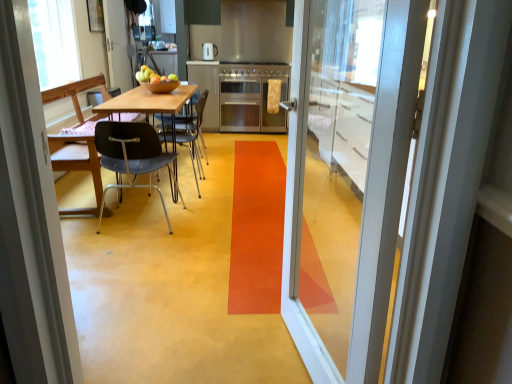
Describe the element at coordinates (133, 157) in the screenshot. I see `black plastic chair at left, the 2th chair viewed from the right` at that location.

Where is `black plastic chair at left, the 2th chair viewed from the right`? The image size is (512, 384). black plastic chair at left, the 2th chair viewed from the right is located at coordinates (133, 157).

How much space does white glossy door at upper left, which is counted as the 1th door, starting from the left, occupy horizontally?

The width of white glossy door at upper left, which is counted as the 1th door, starting from the left, is 4.67 inches.

Describe the element at coordinates (149, 103) in the screenshot. I see `wooden table at center` at that location.

You are a GUI agent. You are given a task and a screenshot of the screen. Output one action in this format:
    pyautogui.click(x=<x>, y=<y>)
    Task: Click on the satin silver refrigerator at center
    The height and width of the screenshot is (384, 512).
    Given the screenshot: What is the action you would take?
    pyautogui.click(x=207, y=89)

Would you consider black plastic chair at left, which is the third chair in left-to-right order, to be distant from white glossy door at upper left, arranged as the first door when viewed from the back?

That's right, there is a large distance between black plastic chair at left, which is the third chair in left-to-right order, and white glossy door at upper left, arranged as the first door when viewed from the back.

Which is behind, black plastic chair at left, which is the third chair in left-to-right order, or white glossy door at upper left, which is counted as the 1th door, starting from the top?

white glossy door at upper left, which is counted as the 1th door, starting from the top, is further away from the camera.

Is point (202, 140) in front of point (113, 36)?

No, it is behind (113, 36).

Is black plastic chair at left, the second chair viewed from the left, aimed at matte silver kettle at center?

Yes, black plastic chair at left, the second chair viewed from the left, is oriented towards matte silver kettle at center.

From a real-world perspective, is black plastic chair at left, the 2th chair viewed from the right, over matte silver kettle at center?

Actually, black plastic chair at left, the 2th chair viewed from the right, is physically below matte silver kettle at center in the real world.

From the picture: Measure the distance between black plastic chair at left, the 2th chair viewed from the right, and matte silver kettle at center.

black plastic chair at left, the 2th chair viewed from the right, is 3.48 meters away from matte silver kettle at center.

Between black plastic chair at left, the second chair viewed from the left, and matte silver kettle at center, which one has smaller width?

matte silver kettle at center is thinner.

From a real-world perspective, between white glossy door at upper left, the second door viewed from the right, and black plastic chair at left, which is the third chair in left-to-right order, who is vertically lower?

black plastic chair at left, which is the third chair in left-to-right order, from a real-world perspective.

Can black plastic chair at left, which is the third chair in left-to-right order, be found inside white glossy door at upper left, arranged as the first door when viewed from the back?

No, black plastic chair at left, which is the third chair in left-to-right order, is not a part of white glossy door at upper left, arranged as the first door when viewed from the back.

From the image's perspective, does white glossy door at upper left, the second door positioned from the front, appear lower than black plastic chair at left, which is the third chair in left-to-right order?

No, from the image's perspective, white glossy door at upper left, the second door positioned from the front, is not beneath black plastic chair at left, which is the third chair in left-to-right order.

Who is smaller, white glossy door at upper left, arranged as the first door when viewed from the back, or black plastic chair at left, positioned as the 1th chair in right-to-left order?

white glossy door at upper left, arranged as the first door when viewed from the back.

In the scene shown: From a real-world perspective, is satin silver refrigerator at center physically located above or below black plastic chair at left, the 2th chair viewed from the right?

satin silver refrigerator at center is above black plastic chair at left, the 2th chair viewed from the right.

From the image's perspective, between satin silver refrigerator at center and black plastic chair at left, the second chair viewed from the left, which one is located above?

satin silver refrigerator at center, from the image's perspective.

Is black plastic chair at left, the 2th chair viewed from the right, a part of satin silver refrigerator at center?

That's incorrect, black plastic chair at left, the 2th chair viewed from the right, is not inside satin silver refrigerator at center.

Which is more to the right, black plastic chair at left, the second chair viewed from the left, or transparent plastic window screen at upper left?

black plastic chair at left, the second chair viewed from the left, is more to the right.

Which of these two, black plastic chair at left, the second chair viewed from the left, or transparent plastic window screen at upper left, is bigger?

transparent plastic window screen at upper left is bigger.

Is black plastic chair at left, the second chair viewed from the left, completely or partially outside of transparent plastic window screen at upper left?

black plastic chair at left, the second chair viewed from the left, lies outside transparent plastic window screen at upper left's area.

Is black plastic chair at left, the second chair viewed from the left, oriented away from transparent plastic window screen at upper left?

black plastic chair at left, the second chair viewed from the left, is not turned away from transparent plastic window screen at upper left.

Locate an element on the screen. appliance that is above the transparent plastic window screen at upper left (from the image's perspective) is located at coordinates (209, 51).

Can you tell me how much matte silver kettle at center and transparent plastic window screen at upper left differ in facing direction?

matte silver kettle at center and transparent plastic window screen at upper left are facing 88.4 degrees away from each other.

Is matte silver kettle at center closer to camera compared to transparent plastic window screen at upper left?

No, it is not.

Does matte silver kettle at center appear on the left side of transparent plastic window screen at upper left?

Incorrect, matte silver kettle at center is not on the left side of transparent plastic window screen at upper left.

Considering the relative sizes of shiny brown bowl at center and transparent plastic window screen at upper left in the image provided, is shiny brown bowl at center bigger than transparent plastic window screen at upper left?

No.

Locate an element on the screen. The image size is (512, 384). fruit below the transparent plastic window screen at upper left (from the image's perspective) is located at coordinates (153, 76).

Does shiny brown bowl at center have a greater width compared to transparent plastic window screen at upper left?

No.

From the image's perspective, is shiny brown bowl at center on transparent plastic window screen at upper left?

No, from the image's perspective, shiny brown bowl at center is not on top of transparent plastic window screen at upper left.

From the image's perspective, starting from the white glossy door at upper left, the second door viewed from the right, which chair is the 2nd one below? Please provide its 2D coordinates.

[(194, 136)]

Identify the location of chair that is the 2nd one when counting leftward from the matte silver kettle at center. (133, 157).

Based on their spatial positions, is stainless steel stove at center or satin silver refrigerator at center closer to stainless steel oven at center?

Based on the image, stainless steel stove at center appears to be nearer to stainless steel oven at center.

Considering their positions, is wooden table at center positioned further to matte silver kettle at center than black plastic chair at left, which is the third chair in left-to-right order?

Based on the image, wooden table at center appears to be further to matte silver kettle at center.

From the image, which object appears to be farther from matte silver kettle at center, satin silver refrigerator at center or transparent plastic window screen at upper left?

transparent plastic window screen at upper left is further to matte silver kettle at center.

Looking at the image, which one is located further to transparent plastic window screen at upper left, black plastic chair at left, which is the third chair in left-to-right order, or wooden table at center?

Among the two, black plastic chair at left, which is the third chair in left-to-right order, is located further to transparent plastic window screen at upper left.

Looking at the image, which one is located further to satin silver refrigerator at center, black plastic chair at left, the 2th chair viewed from the right, or stainless steel oven at center?

black plastic chair at left, the 2th chair viewed from the right, lies further to satin silver refrigerator at center than the other object.

Looking at the image, which one is located further to stainless steel stove at center, transparent plastic window screen at upper left or black plastic chair at left, the second chair viewed from the left?

black plastic chair at left, the second chair viewed from the left, lies further to stainless steel stove at center than the other object.

Which object lies further to the anchor point satin silver refrigerator at center, black plastic chair at left, the second chair viewed from the left, or stainless steel stove at center?

Based on the image, black plastic chair at left, the second chair viewed from the left, appears to be further to satin silver refrigerator at center.

Looking at the image, which one is located closer to white glossy door at upper left, the second door viewed from the right, matte silver kettle at center or black plastic chair at left, the second chair viewed from the left?

matte silver kettle at center lies closer to white glossy door at upper left, the second door viewed from the right, than the other object.

The image size is (512, 384). Identify the location of table located between metallic blue chair at left, the third chair in the right-to-left sequence, and shiny brown bowl at center in the depth direction. (149, 103).

Locate an element on the screen. table between metallic blue chair at left, placed as the first chair when sorted from left to right, and satin silver refrigerator at center from front to back is located at coordinates (149, 103).

Where is `table located between transparent plastic window screen at upper left and black plastic chair at left, positioned as the 1th chair in right-to-left order, in the left-right direction`? Image resolution: width=512 pixels, height=384 pixels. table located between transparent plastic window screen at upper left and black plastic chair at left, positioned as the 1th chair in right-to-left order, in the left-right direction is located at coordinates (149, 103).

The height and width of the screenshot is (384, 512). I want to click on window screen between black plastic chair at left, positioned as the 1th chair in right-to-left order, and matte silver kettle at center, along the z-axis, so click(x=54, y=42).